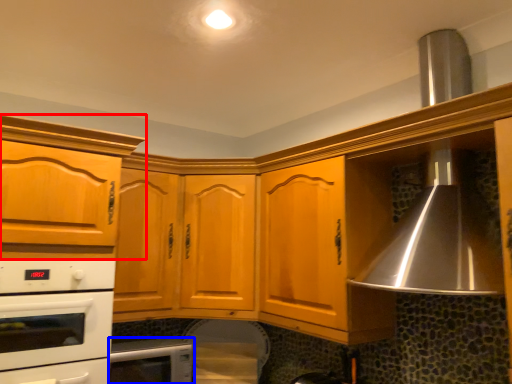
Question: Among these objects, which one is farthest to the camera, cabinetry (highlighted by a red box) or home appliance (highlighted by a blue box)?

Choices:
 (A) cabinetry
 (B) home appliance

Answer: (B)